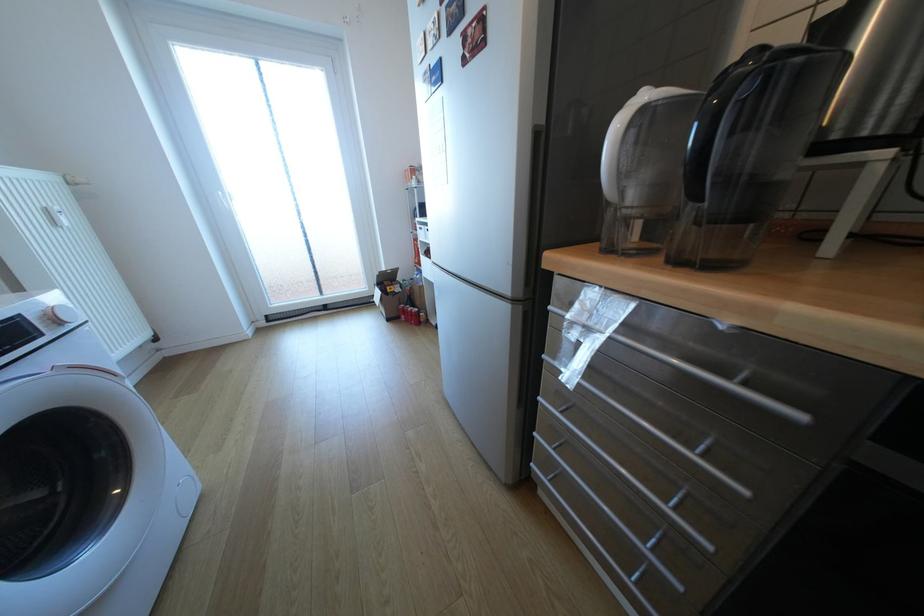
The height and width of the screenshot is (616, 924). I want to click on washing machine dial, so click(x=63, y=314).